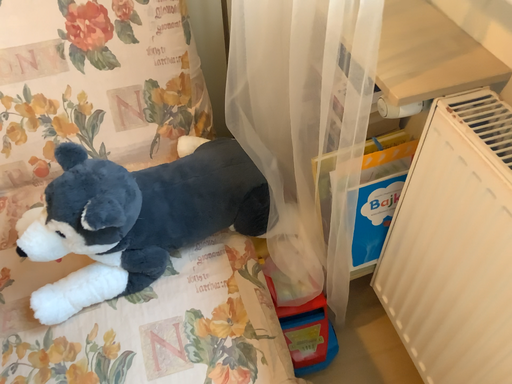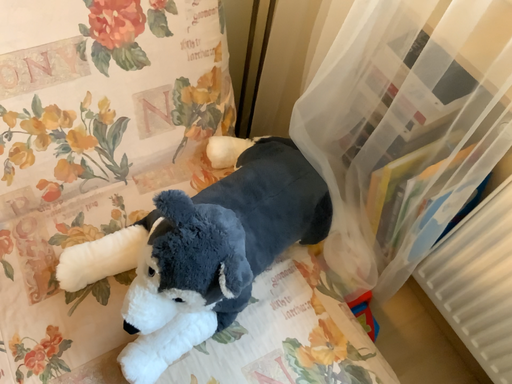
Question: Which way did the camera rotate in the video?

Choices:
 (A) rotated left
 (B) rotated right

Answer: (B)